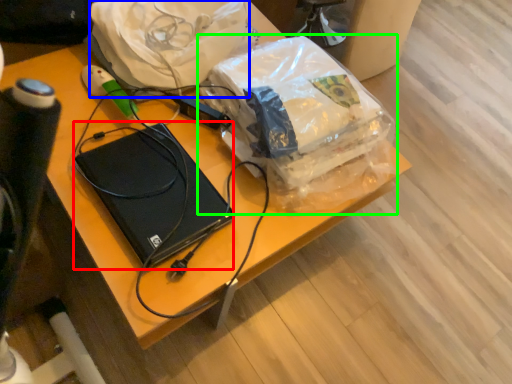
Question: Considering the real-world distances, which object is closest to computer (highlighted by a red box)? material (highlighted by a blue box) or plastic bag (highlighted by a green box).

Choices:
 (A) material
 (B) plastic bag

Answer: (B)